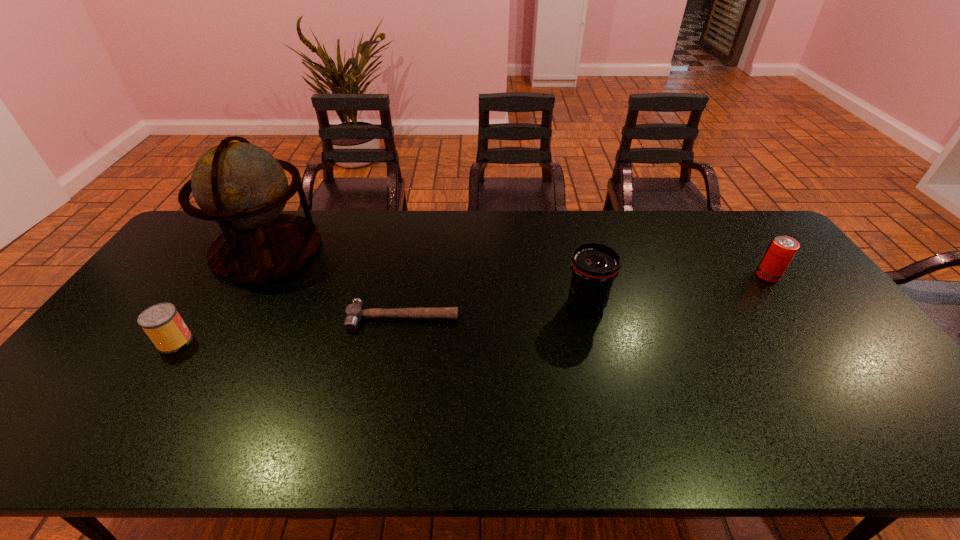
Locate an element on the screen. This screenshot has height=540, width=960. object that stands as the closest to the shortest object is located at coordinates (242, 187).

Image resolution: width=960 pixels, height=540 pixels. Identify the location of object that ranks as the closest to the shorter can. (242, 187).

I want to click on free point that satisfies the following two spatial constraints: 1. on the front-facing side of the second object from right to left; 2. on the right side of the globe, so click(x=234, y=305).

Find the location of a particular element. free space that satisfies the following two spatial constraints: 1. on the front-facing side of the telephoto lens; 2. on the right side of the globe is located at coordinates 234,305.

The height and width of the screenshot is (540, 960). I want to click on vacant space that satisfies the following two spatial constraints: 1. on the front-facing side of the tallest object; 2. on the left side of the second object from right to left, so click(x=234, y=305).

This screenshot has height=540, width=960. I want to click on blank space that satisfies the following two spatial constraints: 1. on the front-facing side of the right can; 2. on the left side of the globe, so click(x=251, y=275).

This screenshot has width=960, height=540. What are the coordinates of `vacant space that satisfies the following two spatial constraints: 1. on the back side of the left can; 2. on the right side of the second object from right to left` in the screenshot? It's located at (200, 305).